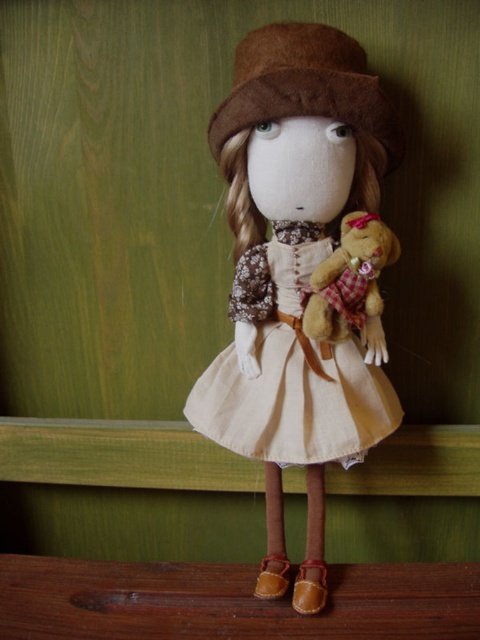
You are an artist trying to paint the doll in the image. You need to decide which of the two points, point (283, 116) or point (336, 296), should be highlighted first because it is closer to the viewer. Which point should you highlight?

Point (283, 116) is closer to the viewer than point (336, 296), so you should highlight point (283, 116) first.

You are a toy designer examining the handmade doll. You notice the beige cotton dress at center and the fluffy brown teddy bear at center. Based on their positions, which object is located lower on the doll?

The beige cotton dress at center is positioned under the fluffy brown teddy bear at center, so the beige cotton dress at center is lower.